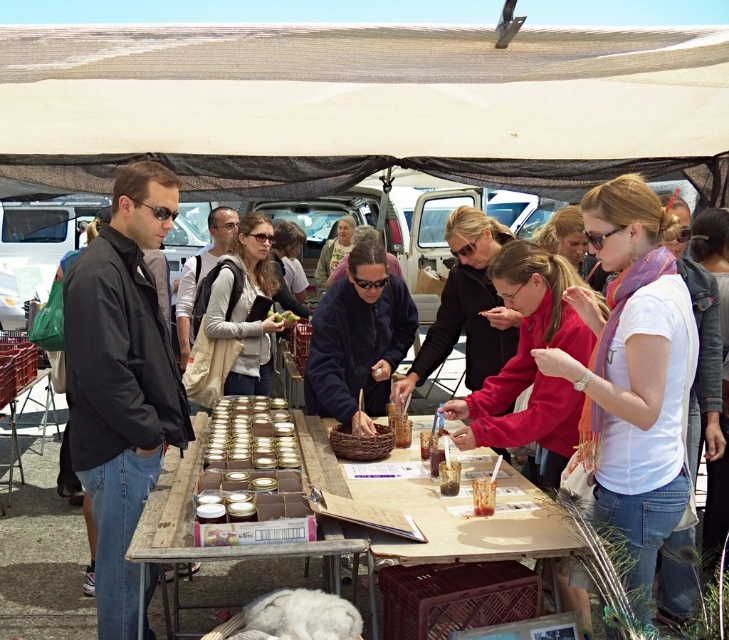
Question: Is black matte jacket at left positioned at the back of matte red jacket at center?

Choices:
 (A) no
 (B) yes

Answer: (A)

Question: Is dark blue fleece at center positioned in front of green matte vegetable at center?

Choices:
 (A) no
 (B) yes

Answer: (B)

Question: Which point is farther from the camera taking this photo?

Choices:
 (A) (480, 337)
 (B) (647, 260)
 (C) (434, 515)
 (D) (136, 381)

Answer: (A)

Question: In this image, where is matte black shirt at center located relative to matte gray sweater at center?

Choices:
 (A) right
 (B) left

Answer: (A)

Question: Among these objects, which one is farthest from the camera?

Choices:
 (A) wooden table at center
 (B) dark blue fleece at center
 (C) matte black shirt at center
 (D) matte red jacket at center

Answer: (B)

Question: Which point is closer to the camera?

Choices:
 (A) wooden table at center
 (B) matte black shirt at center
 (C) dark blue fleece at center
 (D) clear glass jars at center

Answer: (D)